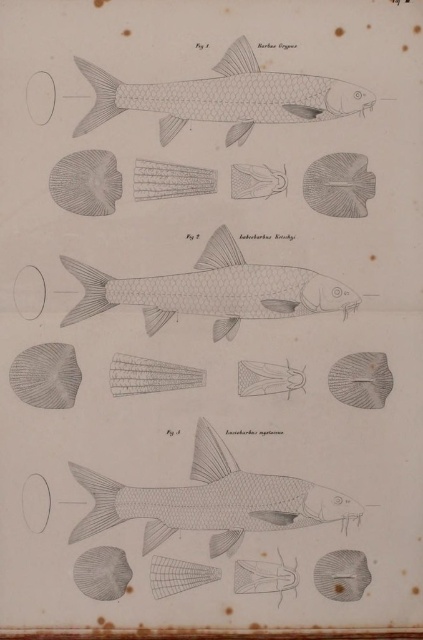
Question: Which point is closer to the camera?

Choices:
 (A) matte gray fish at center right
 (B) grayish matte fish at upper center
 (C) gray textured fish at center

Answer: (B)

Question: Among these objects, which one is nearest to the camera?

Choices:
 (A) grayish silver fish at center
 (B) grayish matte fish at upper center

Answer: (B)

Question: Does smooth gray fish at center come behind grayish matte fish at upper center?

Choices:
 (A) yes
 (B) no

Answer: (A)

Question: Is grayish silver fish at center in front of matte gray fish at center right?

Choices:
 (A) no
 (B) yes

Answer: (A)

Question: Can you confirm if smooth gray fish at center is bigger than grayish silver fish at center?

Choices:
 (A) yes
 (B) no

Answer: (A)

Question: Estimate the real-world distances between objects in this image. Which object is farther from the grayish matte fish at upper center?

Choices:
 (A) smooth gray fish at center
 (B) matte gray fish at center right
 (C) gray textured fish at center
 (D) grayish silver fish at center

Answer: (A)